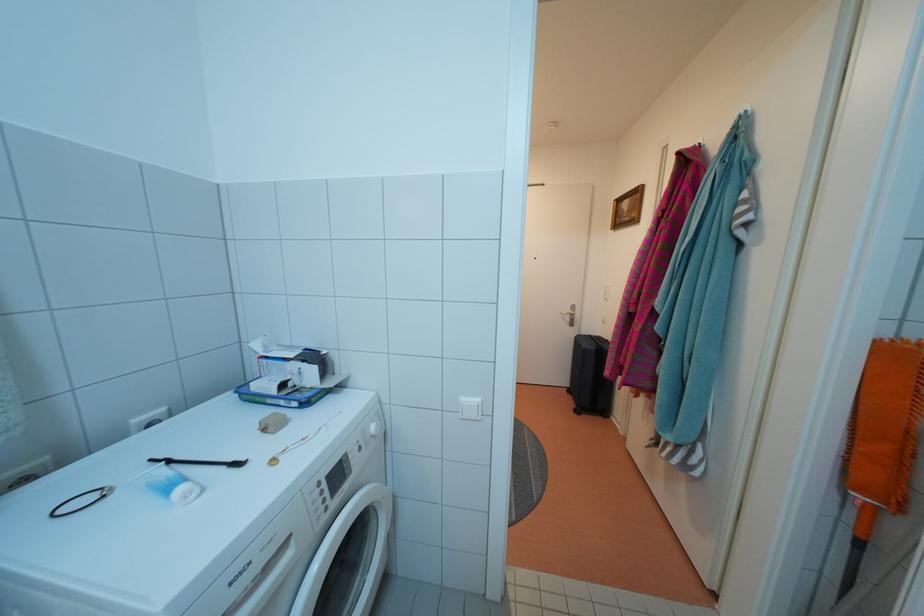
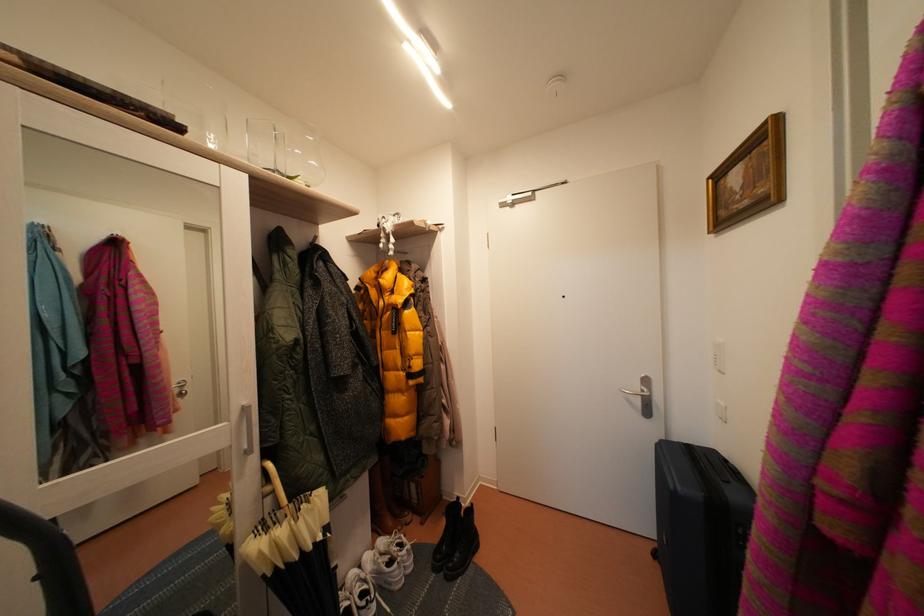
In the second image, find the point that corresponds to (576,315) in the first image.

(645, 392)